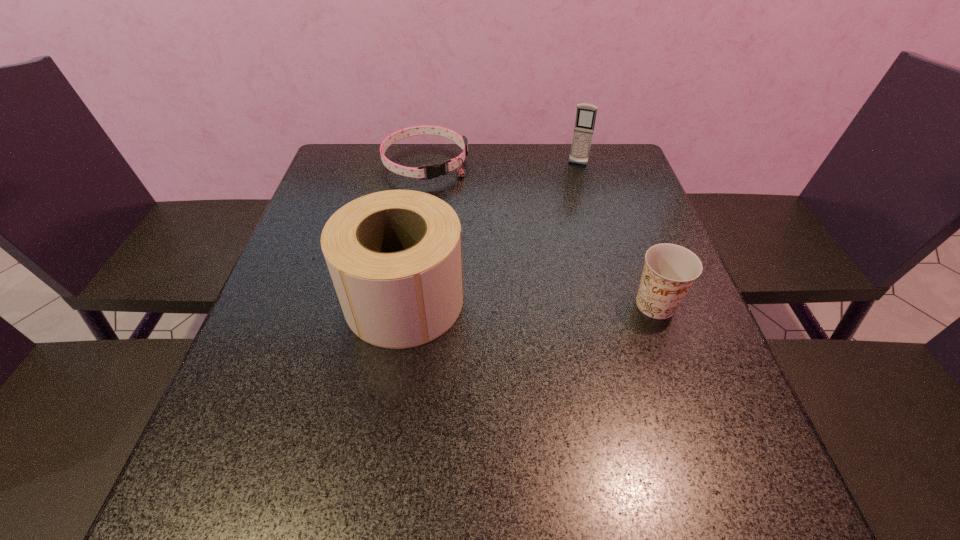
Where is `vacant space at the far edge`? vacant space at the far edge is located at coordinates (559, 187).

The image size is (960, 540). In order to click on vacant region at the near edge of the desktop in this screenshot , I will do `click(387, 439)`.

Where is `vacant space at the left edge of the desktop`? This screenshot has width=960, height=540. vacant space at the left edge of the desktop is located at coordinates (312, 340).

The width and height of the screenshot is (960, 540). I want to click on vacant space at the right edge of the desktop, so click(x=702, y=363).

In the image, there is a desktop. At what (x,y) coordinates should I click in order to perform the action: click on vacant region at the far left corner. Please return your answer as a coordinate pair (x, y). Image resolution: width=960 pixels, height=540 pixels. Looking at the image, I should click on (348, 172).

Image resolution: width=960 pixels, height=540 pixels. In the image, there is a desktop. In order to click on vacant space at the far right corner in this screenshot , I will do coord(623,174).

Where is `vacant space that is in between the cellular telephone and the Dixie cup`? This screenshot has height=540, width=960. vacant space that is in between the cellular telephone and the Dixie cup is located at coordinates (616, 234).

Where is `unoccupied position between the third tallest object and the toilet tissue`? The image size is (960, 540). unoccupied position between the third tallest object and the toilet tissue is located at coordinates (530, 302).

At what (x,y) coordinates should I click in order to perform the action: click on empty space between the toilet tissue and the cellular telephone. Please return your answer as a coordinate pair (x, y). The image size is (960, 540). Looking at the image, I should click on (491, 232).

At what (x,y) coordinates should I click in order to perform the action: click on vacant area that lies between the Dixie cup and the cellular telephone. Please return your answer as a coordinate pair (x, y). The image size is (960, 540). Looking at the image, I should click on (616, 234).